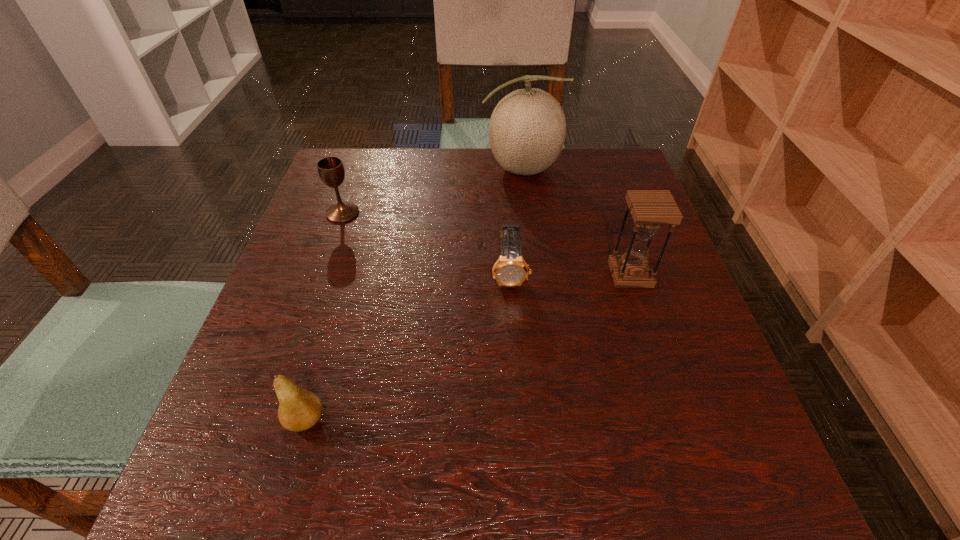
The image size is (960, 540). I want to click on free space at the far right corner of the desktop, so click(594, 159).

In the image, there is a desktop. Identify the location of vacant space at the near right corner. (770, 518).

The width and height of the screenshot is (960, 540). Find the location of `vacant area that lies between the fourth nearest object and the rightmost object`. vacant area that lies between the fourth nearest object and the rightmost object is located at coordinates (487, 244).

Identify the location of blank region between the pear and the hourglass. coord(468,347).

I want to click on free space between the hourglass and the watch, so click(570, 275).

This screenshot has width=960, height=540. In order to click on blank region between the rightmost object and the watch in this screenshot , I will do `click(570, 275)`.

The image size is (960, 540). I want to click on free space between the chalice and the hourglass, so click(x=487, y=244).

This screenshot has height=540, width=960. I want to click on free spot between the nearest object and the hourglass, so click(x=468, y=347).

Identify the location of vacant space in between the watch and the cantaloup. The width and height of the screenshot is (960, 540). (516, 222).

You are a GUI agent. You are given a task and a screenshot of the screen. Output one action in this format:
    pyautogui.click(x=<x>, y=<y>)
    Task: Click on the vacant area between the watch and the farthest object
    
    Given the screenshot: What is the action you would take?
    pyautogui.click(x=516, y=222)